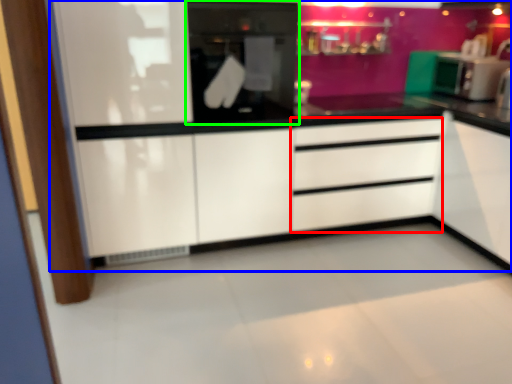
Question: Which object is positioned farthest from drawer (highlighted by a red box)? Select from dresser (highlighted by a blue box) and home appliance (highlighted by a green box).

Choices:
 (A) dresser
 (B) home appliance

Answer: (B)